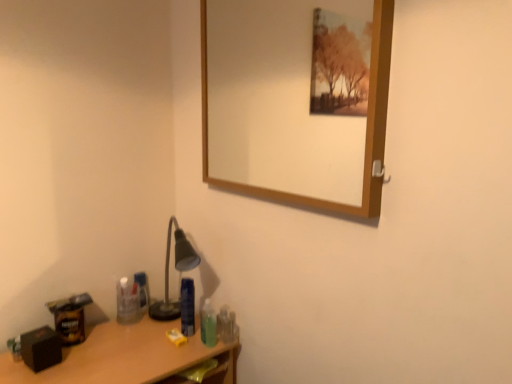
I want to click on free region on the left part of translucent plastic toothbrush at lower right, which is counted as the 3th toiletry, starting from the back, so click(175, 336).